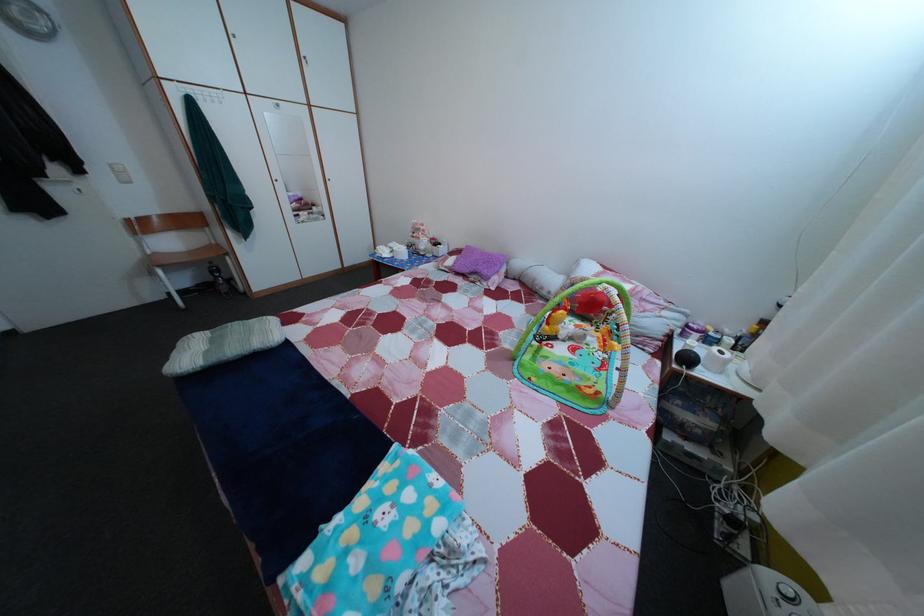
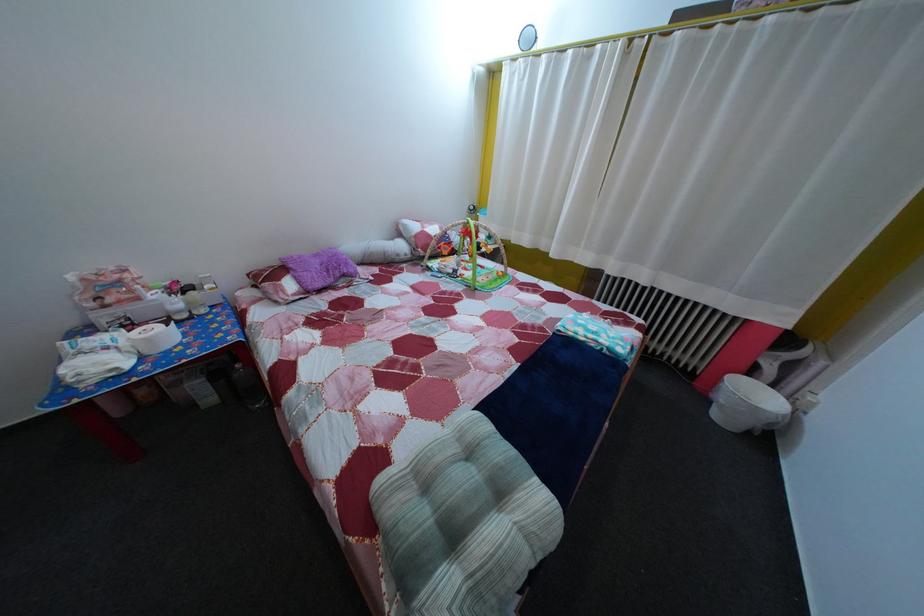
Locate, in the second image, the point that corresponds to pixel 407 471 in the first image.

(578, 334)